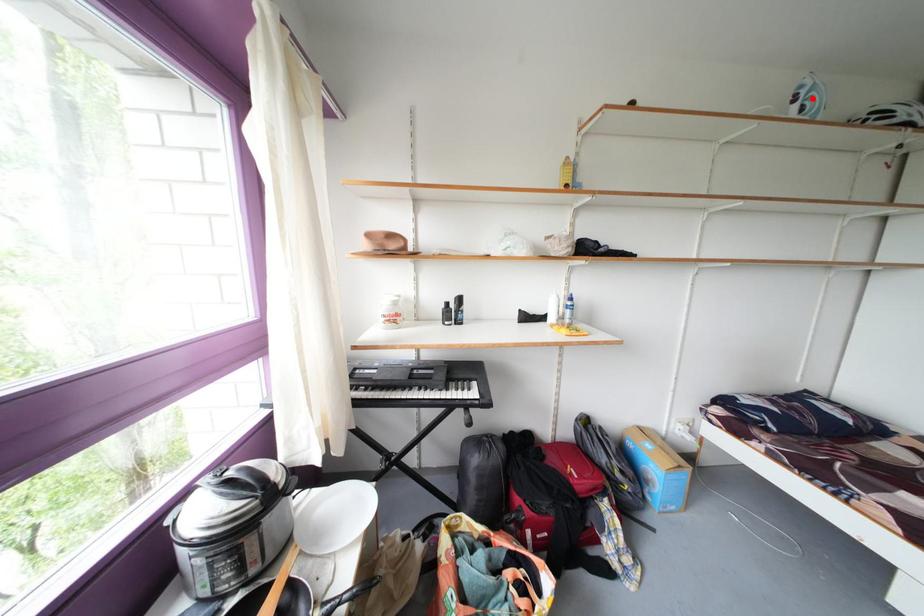
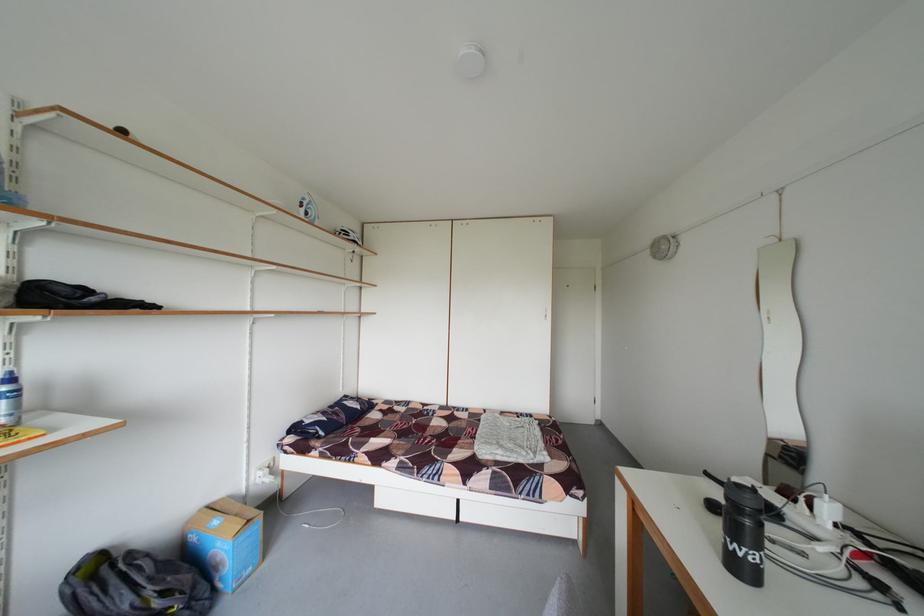
Locate, in the second image, the point that corresponds to the highlighted location in the first image.

(315, 209)